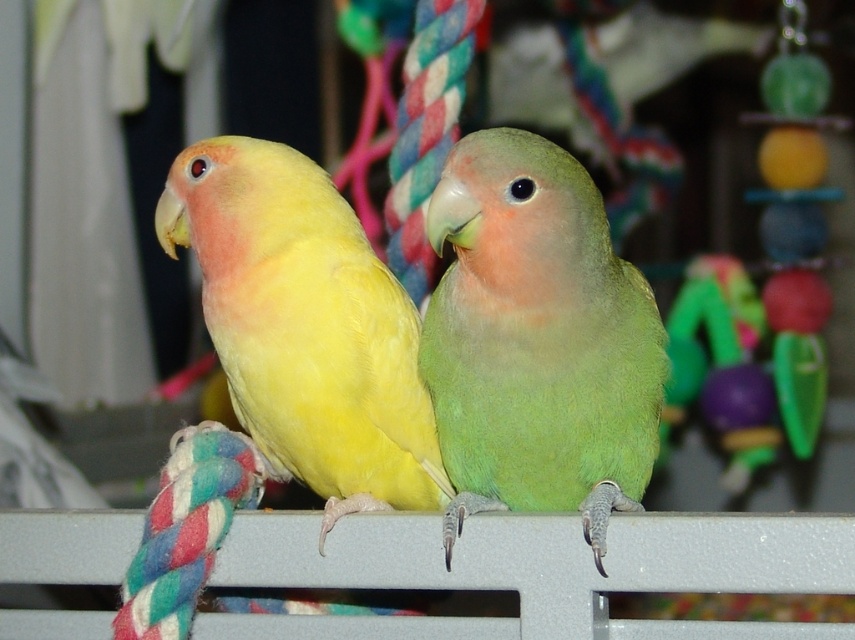
Question: Which point appears farthest from the camera in this image?

Choices:
 (A) (481, 232)
 (B) (404, 348)

Answer: (B)

Question: Is the position of green matte parrot at center less distant than that of yellow matte parrot at left?

Choices:
 (A) no
 (B) yes

Answer: (B)

Question: Is green matte parrot at center in front of yellow matte parrot at left?

Choices:
 (A) no
 (B) yes

Answer: (B)

Question: Which of the following is the closest to the observer?

Choices:
 (A) (466, 160)
 (B) (286, 321)

Answer: (A)

Question: Which point appears farthest from the camera in this image?

Choices:
 (A) (428, 228)
 (B) (298, 152)

Answer: (B)

Question: Can you confirm if green matte parrot at center is smaller than yellow matte parrot at left?

Choices:
 (A) no
 (B) yes

Answer: (B)